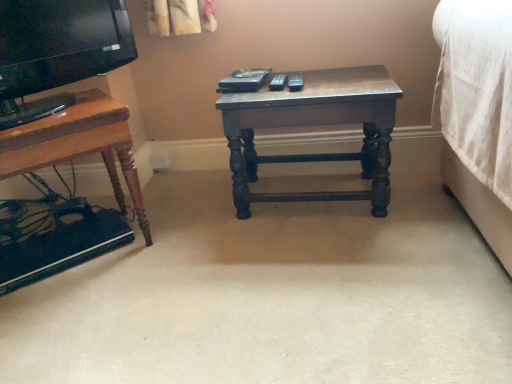
What are the coordinates of `free space above dark wood table at center, marked as the first table in a right-to-left arrangement (from a real-world perspective)` in the screenshot? It's located at (279, 83).